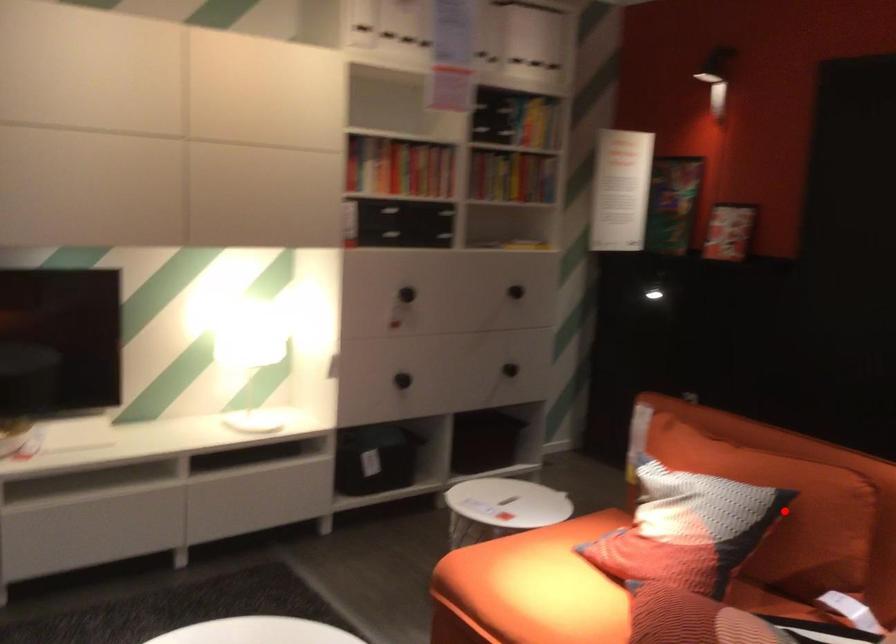
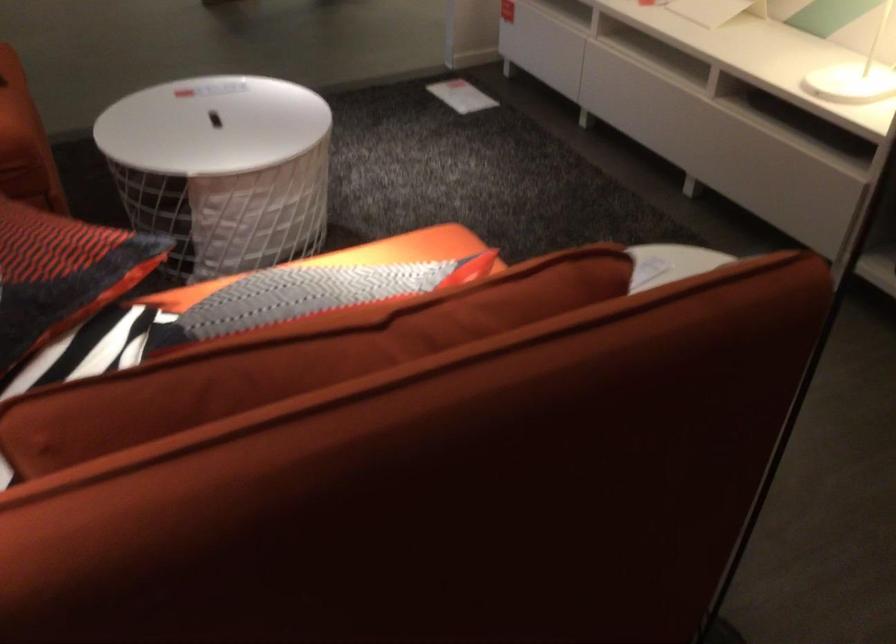
Question: I am providing you with two images of the same scene from different viewpoints. A red point is marked on the first image. Is the red point's position out of view in image 2?

Choices:
 (A) Yes
 (B) No

Answer: (A)